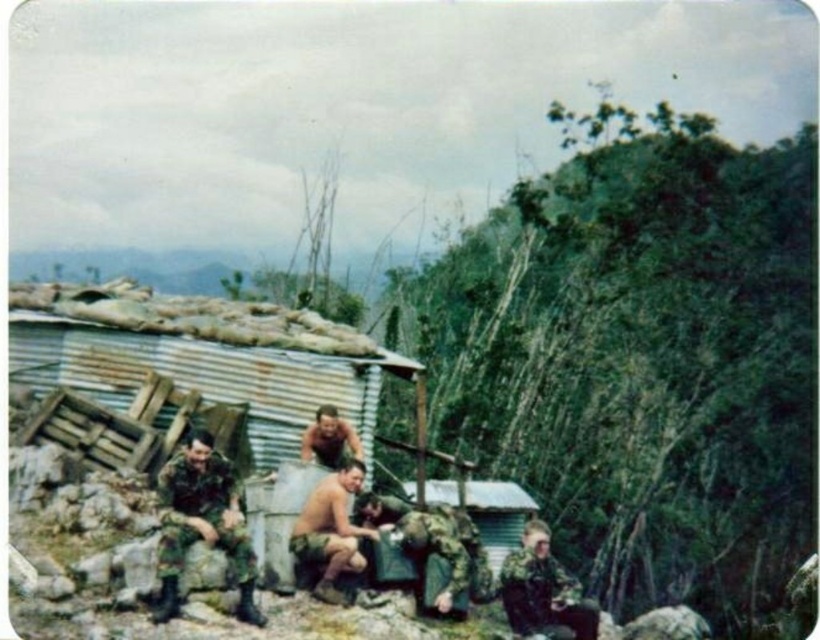
You are a military medic assessing the clothing layers of a soldier in the scene. The soldier is wearing both the brown camouflage shorts at center and the brown camouflage uniform at center. Which clothing item is closer to the soldier?

The brown camouflage shorts at center is positioned under the brown camouflage uniform at center, so the shorts are closer to the soldier.

You are a drone operator trying to capture a detailed image of two specific points in the scene. The first point is at coordinates point [215,477] and the second is at point [410,534]. Which point should you focus on first to ensure it appears larger in your camera view?

Point [215,477] is closer to the camera than point [410,534], so focusing on point [215,477] first will make it appear larger in the camera view.

You are a photographer trying to capture a group photo of the soldiers in the scene. You want to ensure both the camouflage fabric uniform at lower left and the camouflage fabric shirt at center are visible in the frame. Based on their positions, which one should you focus on first to ensure it doesn

The camouflage fabric uniform at lower left is above the camouflage fabric shirt at center. Therefore, you should focus on the camouflage fabric uniform at lower left first to ensure it is in the frame before adjusting the camera to include the camouflage fabric shirt at center below it.